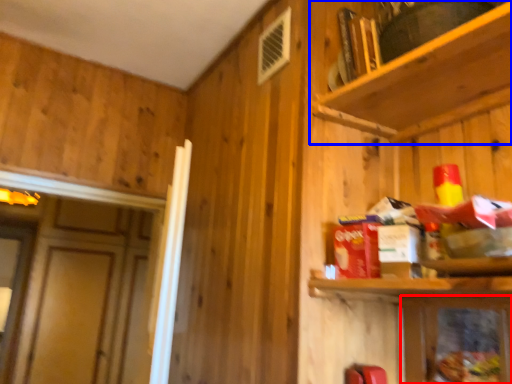
Question: Which point is closer to the camera, cabinetry (highlighted by a red box) or shelf (highlighted by a blue box)?

Choices:
 (A) cabinetry
 (B) shelf

Answer: (B)